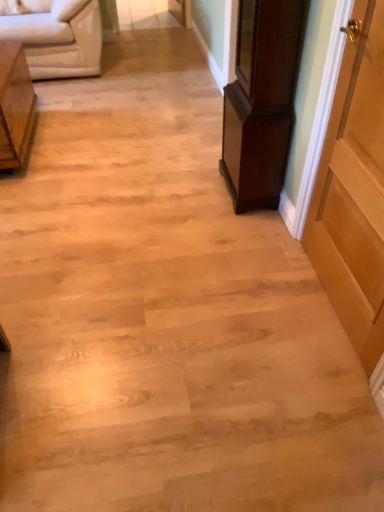
Question: Considering their positions, is light brown wood side table at left, marked as the 2th furniture in a right-to-left arrangement, located in front of or behind white leather studio couch at upper left?

Choices:
 (A) behind
 (B) front

Answer: (B)

Question: Is light brown wood side table at left, the 1th furniture when ordered from left to right, wider or thinner than white leather studio couch at upper left?

Choices:
 (A) thin
 (B) wide

Answer: (A)

Question: Based on their relative distances, which object is farther from the light brown wood door at right?

Choices:
 (A) dark wood cabinet at right, which ranks as the 2th furniture in left-to-right order
 (B) light brown wood side table at left, the 1th furniture when ordered from left to right
 (C) white leather studio couch at upper left

Answer: (C)

Question: Which object is the closest to the light brown wood door at right?

Choices:
 (A) dark wood cabinet at right, which is counted as the first furniture, starting from the right
 (B) white leather studio couch at upper left
 (C) light brown wood side table at left, the 1th furniture when ordered from left to right

Answer: (A)